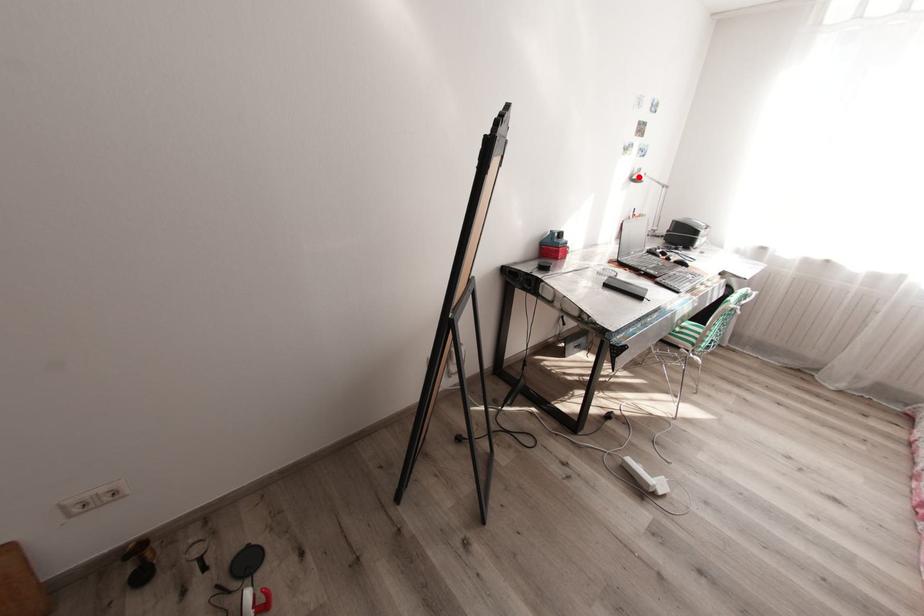
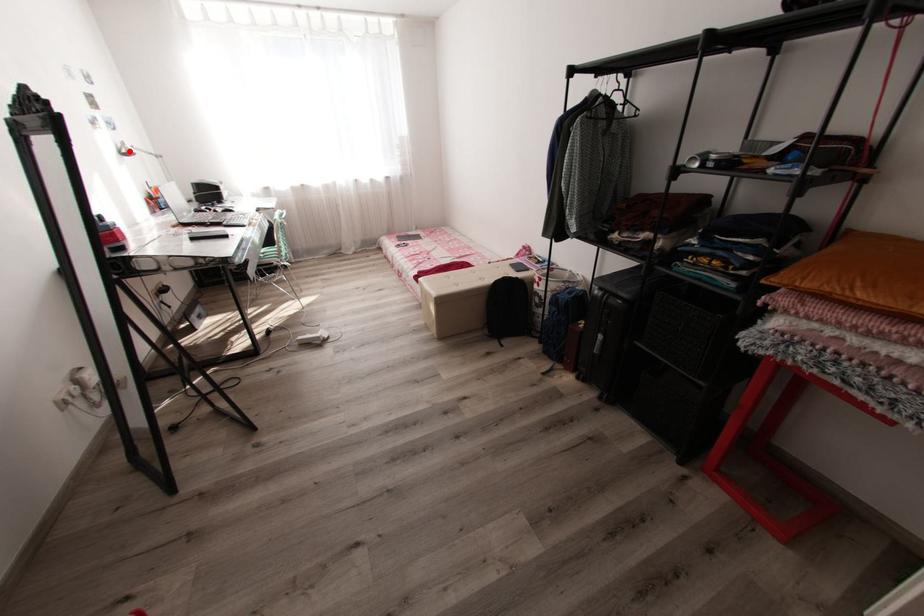
I am providing you with two images of the same scene from different viewpoints. A red point is marked on the first image and another point is marked on the second image. Do the highlighted points in image1 and image2 indicate the same real-world spot?

Yes